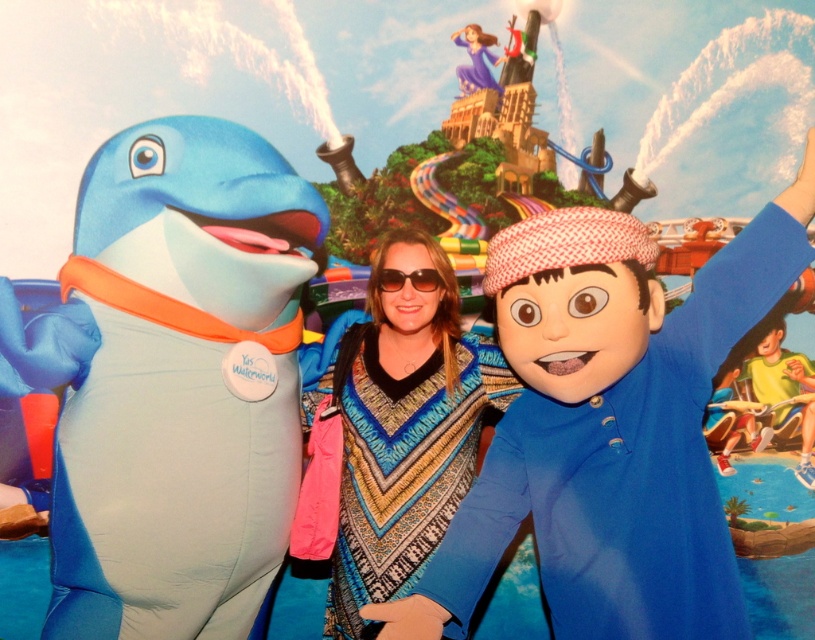
You are a photographer at Yas Waterworld and want to capture a photo of the patterned poncho at center and sunglasses at center. Which object should you zoom in on to ensure both are fully visible in the frame without cropping? Explain your reasoning using their sizes.

The patterned poncho at center is wider than the sunglasses at center. To ensure both are fully visible without cropping, you should zoom in on the patterned poncho at center since it requires more space due to its greater width.

You are standing at the camera position and want to take a photo of the point at coordinates point (706, 284). The park requires that visitors must be at least 5 feet away from any attraction or character to ensure safety. Is your current position safe?

The point (706, 284) is 6.73 feet away from the camera, so yes, your current position is safe as it meets the minimum distance requirement of 5 feet.